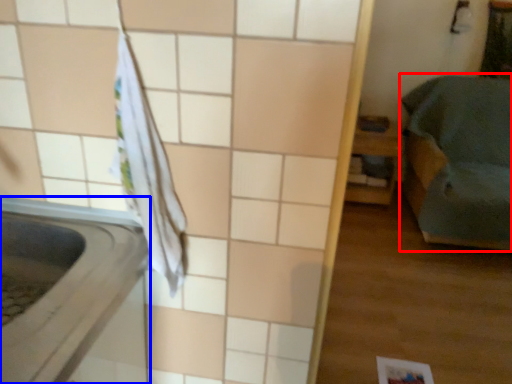
Question: Among these objects, which one is farthest to the camera, furniture (highlighted by a red box) or appliance (highlighted by a blue box)?

Choices:
 (A) furniture
 (B) appliance

Answer: (A)